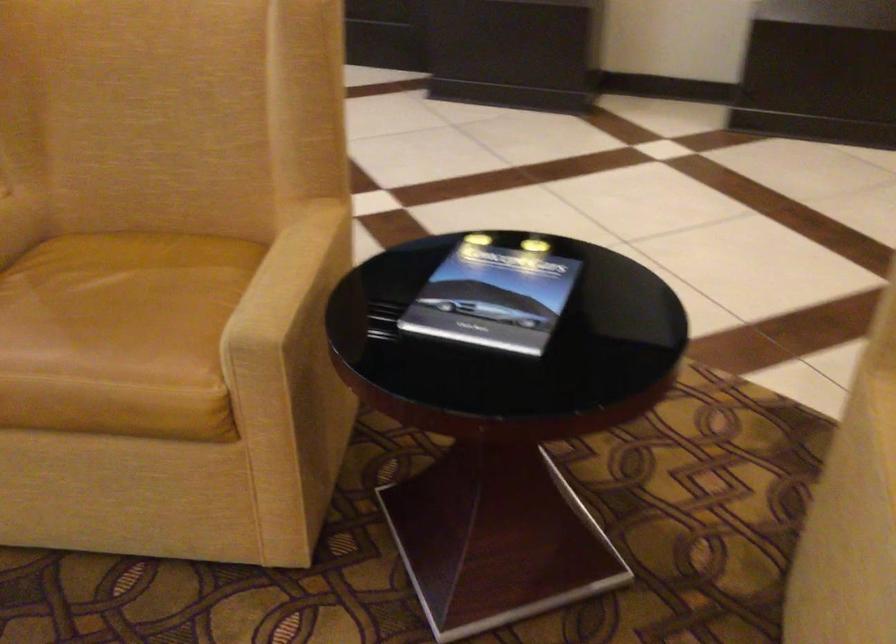
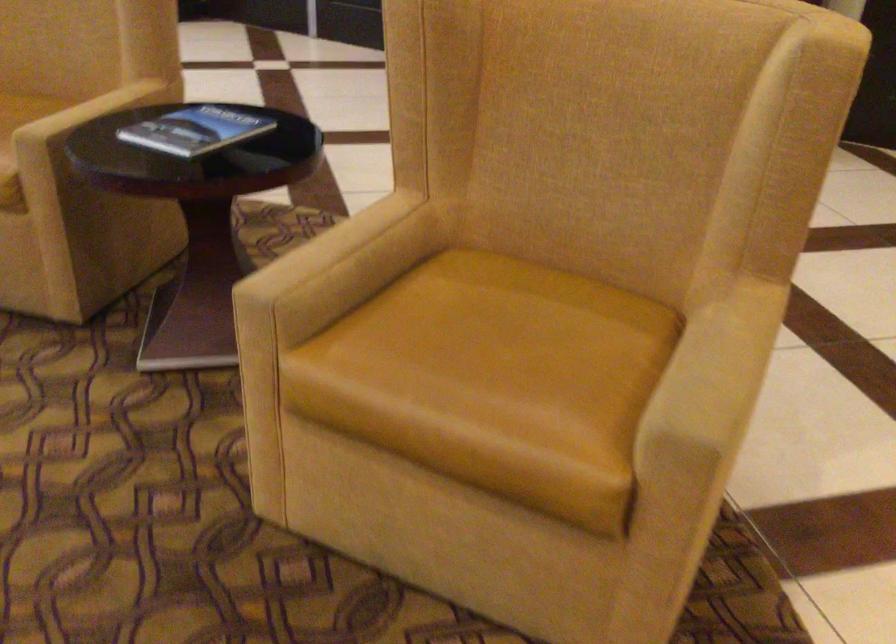
In a continuous first-person perspective shot, in which direction is the camera moving?

The cameraman walked toward right, backward.